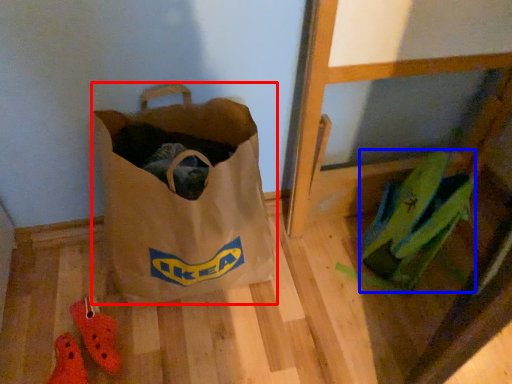
Question: Which point is closer to the camera, luggage and bags (highlighted by a red box) or grocery bag (highlighted by a blue box)?

Choices:
 (A) luggage and bags
 (B) grocery bag

Answer: (A)